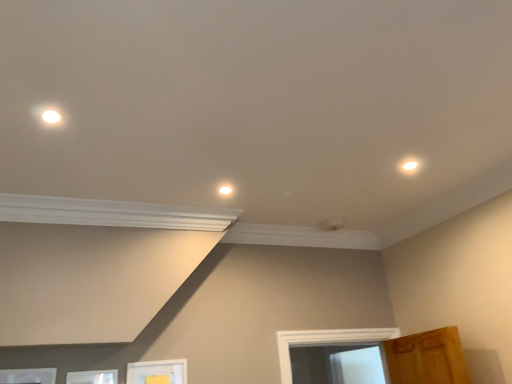
Question: Is white glossy light fixture at center, placed as the 2th dot when sorted from front to back, taller than white glossy light fixture at upper right, which ranks as the second dot in back-to-front order?

Choices:
 (A) yes
 (B) no

Answer: (B)

Question: Is white glossy light fixture at center, which is the 2th dot in right-to-left order, outside white glossy light fixture at upper right, the 1th dot viewed from the front?

Choices:
 (A) no
 (B) yes

Answer: (B)

Question: Considering the relative positions of white glossy light fixture at center, acting as the first dot starting from the back, and white glossy light fixture at upper right, which is the 1th dot in right-to-left order, in the image provided, is white glossy light fixture at center, acting as the first dot starting from the back, behind white glossy light fixture at upper right, which is the 1th dot in right-to-left order,?

Choices:
 (A) no
 (B) yes

Answer: (B)

Question: From the image's perspective, does white glossy light fixture at center, the 2th dot from the top, appear lower than white glossy light fixture at upper right, acting as the second dot starting from the left?

Choices:
 (A) yes
 (B) no

Answer: (A)

Question: Is the depth of white glossy light fixture at center, the 1th dot when ordered from bottom to top, less than that of white glossy light fixture at upper right, acting as the second dot starting from the left?

Choices:
 (A) yes
 (B) no

Answer: (B)

Question: Is point (143, 379) positioned closer to the camera than point (408, 160)?

Choices:
 (A) farther
 (B) closer

Answer: (A)

Question: From a real-world perspective, relative to white glossy light fixture at upper right, marked as the first dot in a top-to-bottom arrangement, is white matte picture frame at lower center, which appears as the 3th picture frame when viewed from the left, vertically above or below?

Choices:
 (A) below
 (B) above

Answer: (A)

Question: Based on their sizes in the image, would you say white matte picture frame at lower center, which appears as the 3th picture frame when viewed from the left, is bigger or smaller than white glossy light fixture at upper right, which is the 1th dot in right-to-left order?

Choices:
 (A) small
 (B) big

Answer: (B)

Question: From the image's perspective, is white matte picture frame at lower center, the first picture frame viewed from the right, located above or below white glossy light fixture at upper right, marked as the first dot in a top-to-bottom arrangement?

Choices:
 (A) above
 (B) below

Answer: (B)

Question: Relative to white matte picture frame at lower left, the 1th picture frame when ordered from left to right, is white glossy light fixture at upper right, which appears as the 2th dot when ordered from the bottom, in front or behind?

Choices:
 (A) front
 (B) behind

Answer: (B)

Question: Is white glossy light fixture at upper right, which is the 1th dot in right-to-left order, bigger or smaller than white matte picture frame at lower left, the 1th picture frame when ordered from left to right?

Choices:
 (A) big
 (B) small

Answer: (B)

Question: Would you say white glossy light fixture at upper right, the 1th dot viewed from the front, is to the left or to the right of white matte picture frame at lower left, the 1th picture frame when ordered from left to right, in the picture?

Choices:
 (A) left
 (B) right

Answer: (B)

Question: Looking at their shapes, would you say white glossy light fixture at upper right, acting as the second dot starting from the left, is wider or thinner than white matte picture frame at lower left, the 1th picture frame when ordered from left to right?

Choices:
 (A) thin
 (B) wide

Answer: (B)

Question: From the image's perspective, is white matte picture frame at lower left, the 1th picture frame when ordered from left to right, above or below white glossy light fixture at center, placed as the 2th dot when sorted from front to back?

Choices:
 (A) above
 (B) below

Answer: (B)

Question: Considering the positions of white matte picture frame at lower left, acting as the 3th picture frame starting from the right, and white glossy light fixture at center, placed as the 2th dot when sorted from front to back, in the image, is white matte picture frame at lower left, acting as the 3th picture frame starting from the right, bigger or smaller than white glossy light fixture at center, placed as the 2th dot when sorted from front to back,?

Choices:
 (A) small
 (B) big

Answer: (B)